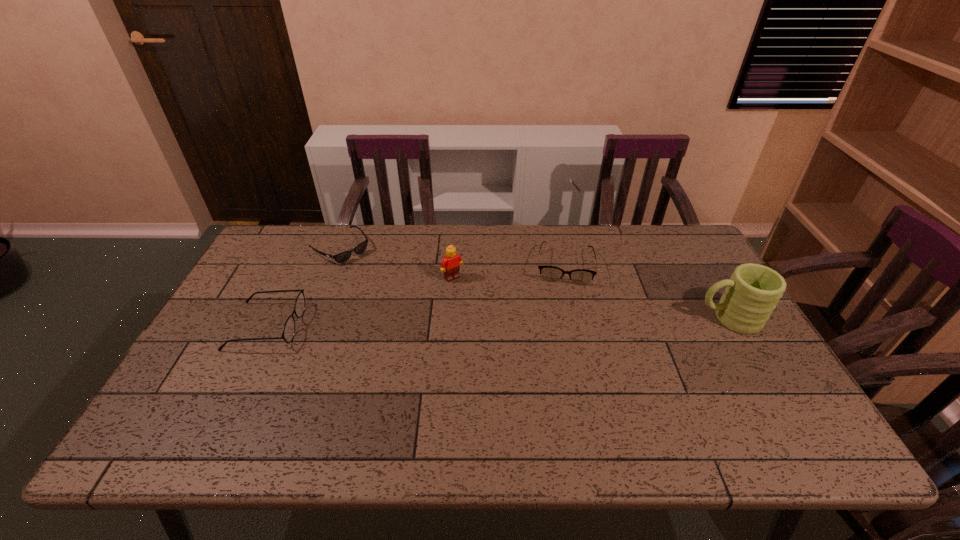
Image resolution: width=960 pixels, height=540 pixels. I want to click on vacant space on the desktop that is between the left spectacles and the rightmost object and is positioned on the face of the Lego, so click(x=491, y=322).

Locate an element on the screen. free space on the desktop that is between the nearer spectacles and the tallest object and is positioned on the face of the farther spectacles is located at coordinates (562, 321).

You are a GUI agent. You are given a task and a screenshot of the screen. Output one action in this format:
    pyautogui.click(x=<x>, y=<y>)
    Task: Click on the free space on the desktop that is between the nearer spectacles and the tallest object and is positioned on the front-facing side of the sunglasses
    
    Given the screenshot: What is the action you would take?
    pyautogui.click(x=432, y=323)